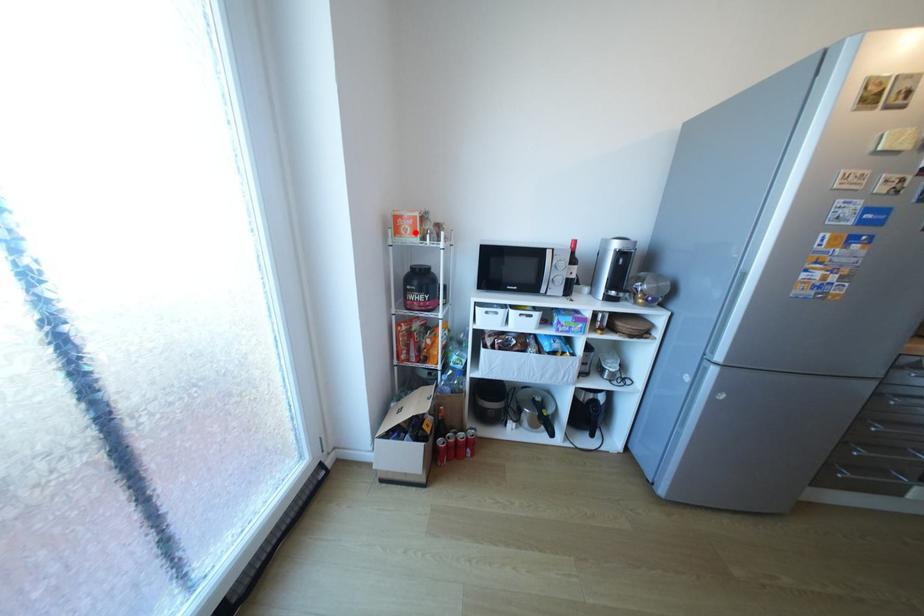
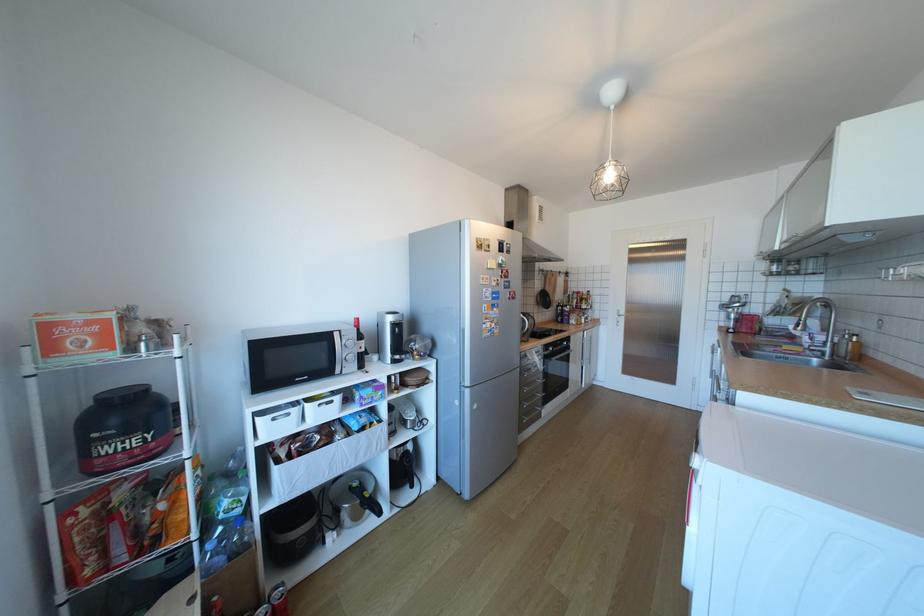
Question: I am providing you with two images of the same scene from different viewpoints. A red point is marked on the first image. Is the red point's position out of view in image 2?

Choices:
 (A) Yes
 (B) No

Answer: (B)